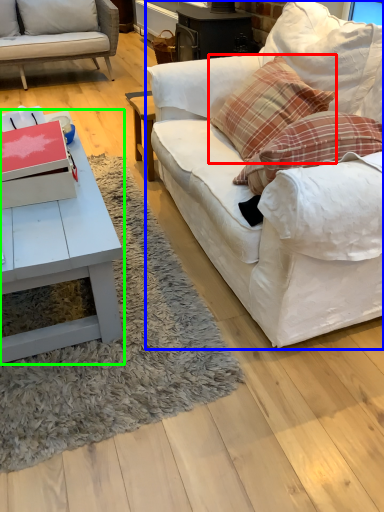
Question: Which object is the closest to the pillow (highlighted by a red box)? Choose among these: studio couch (highlighted by a blue box) or coffee table (highlighted by a green box).

Choices:
 (A) studio couch
 (B) coffee table

Answer: (A)